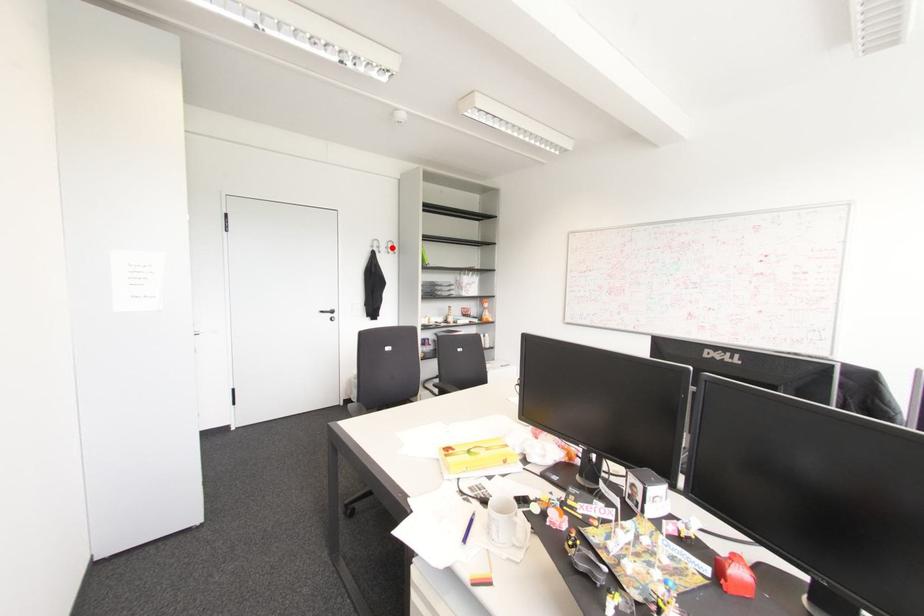
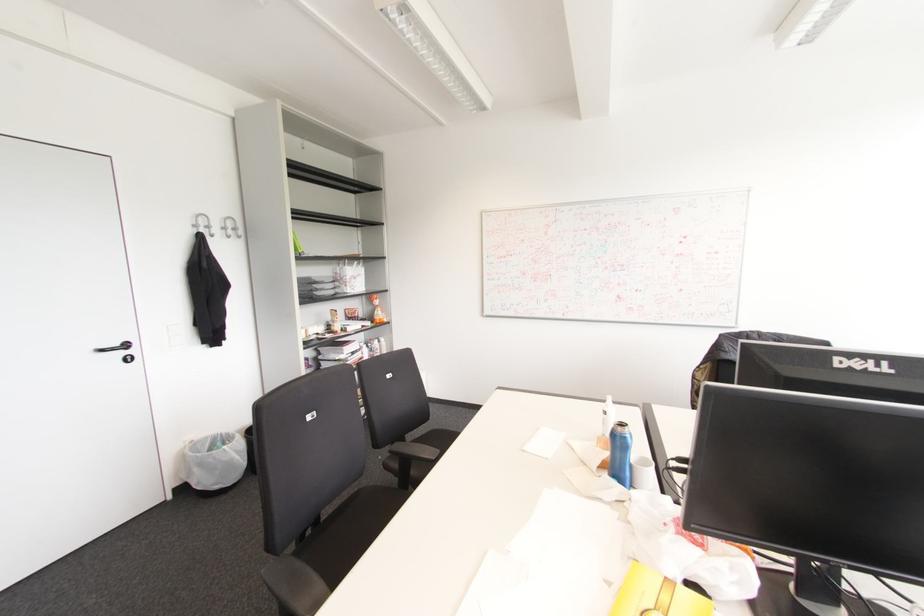
The point at the highlighted location is marked in the first image. Where is the corresponding point in the second image?

(234, 229)